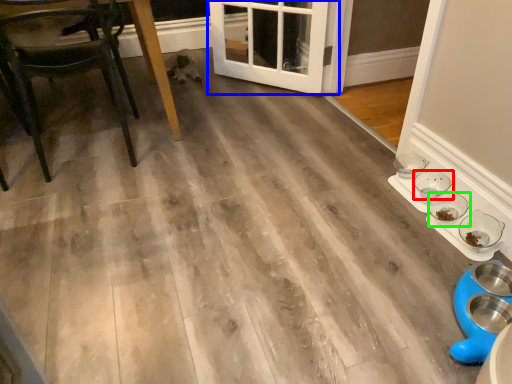
Question: Which is nearer to the bowl (highlighted by a red box)? door (highlighted by a blue box) or bowl (highlighted by a green box).

Choices:
 (A) door
 (B) bowl

Answer: (B)